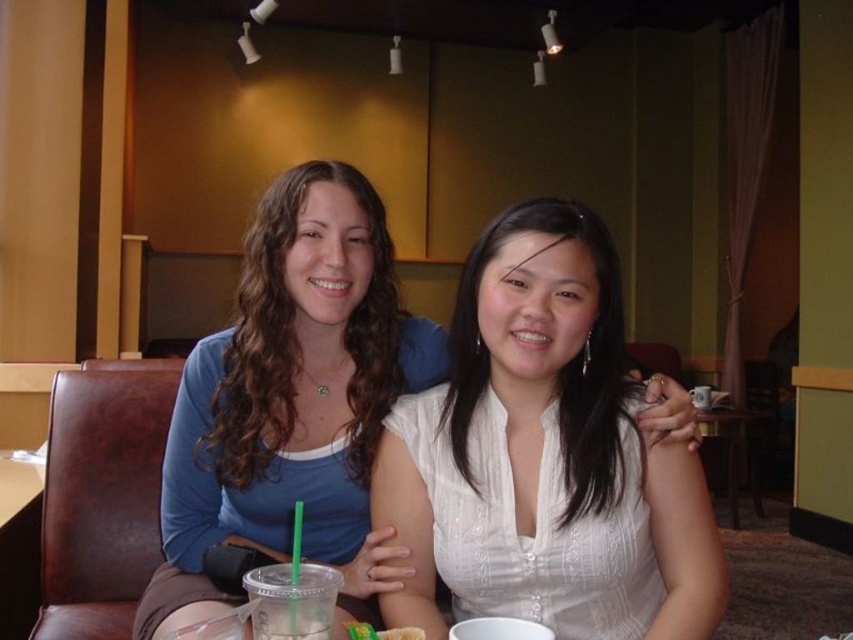
Which is above, white satin blouse at center or green matte bread at center?

Positioned higher is white satin blouse at center.

Identify the location of white satin blouse at center. pos(544,456).

Is white satin blouse at center bigger than wooden table at center?

Actually, white satin blouse at center might be smaller than wooden table at center.

Can you confirm if white satin blouse at center is taller than wooden table at center?

In fact, white satin blouse at center may be shorter than wooden table at center.

Locate an element on the screen. This screenshot has height=640, width=853. white satin blouse at center is located at coordinates (544, 456).

Is clear plastic cup at center wider than wooden table at center?

No.

Can you confirm if clear plastic cup at center is taller than wooden table at center?

In fact, clear plastic cup at center may be shorter than wooden table at center.

Locate an element on the screen. This screenshot has height=640, width=853. clear plastic cup at center is located at coordinates (291, 600).